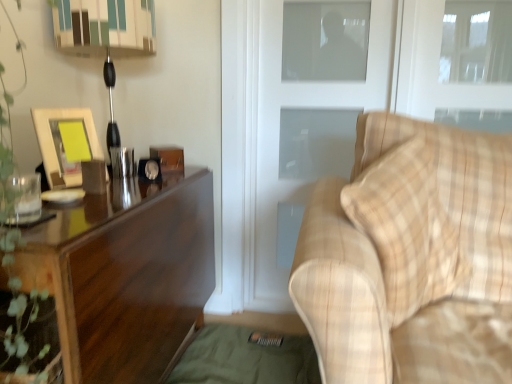
Question: From the image's perspective, does metallic black table lamp at left appear higher than transparent glass window at upper right?

Choices:
 (A) no
 (B) yes

Answer: (A)

Question: Is metallic black table lamp at left next to transparent glass window at upper right?

Choices:
 (A) yes
 (B) no

Answer: (B)

Question: Can you confirm if metallic black table lamp at left is positioned to the right of transparent glass window at upper right?

Choices:
 (A) yes
 (B) no

Answer: (B)

Question: From a real-world perspective, is metallic black table lamp at left over transparent glass window at upper right?

Choices:
 (A) yes
 (B) no

Answer: (B)

Question: Would you say metallic black table lamp at left is outside transparent glass window at upper right?

Choices:
 (A) no
 (B) yes

Answer: (B)

Question: Can you confirm if metallic black table lamp at left is wider than transparent glass window at upper right?

Choices:
 (A) yes
 (B) no

Answer: (A)

Question: Does dark wood desk at left appear on the left side of matte wooden picture frame at left?

Choices:
 (A) no
 (B) yes

Answer: (A)

Question: Is dark wood desk at left outside of matte wooden picture frame at left?

Choices:
 (A) no
 (B) yes

Answer: (B)

Question: From the image's perspective, is dark wood desk at left on matte wooden picture frame at left?

Choices:
 (A) no
 (B) yes

Answer: (A)

Question: Is dark wood desk at left beside matte wooden picture frame at left?

Choices:
 (A) yes
 (B) no

Answer: (B)

Question: Considering the relative positions of dark wood desk at left and matte wooden picture frame at left in the image provided, is dark wood desk at left to the right of matte wooden picture frame at left from the viewer's perspective?

Choices:
 (A) yes
 (B) no

Answer: (A)

Question: Considering the relative sizes of dark wood desk at left and matte wooden picture frame at left in the image provided, is dark wood desk at left wider than matte wooden picture frame at left?

Choices:
 (A) no
 (B) yes

Answer: (B)

Question: From a real-world perspective, is plaid fabric couch at right beneath transparent glass window at upper right?

Choices:
 (A) no
 (B) yes

Answer: (B)